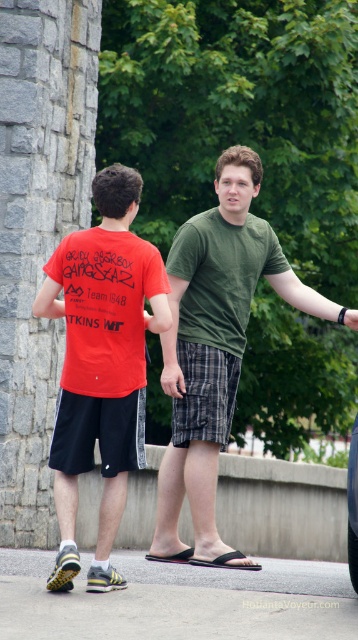
Does matte black hand at center have a greater width compared to black matte wristband at upper right?

In fact, matte black hand at center might be narrower than black matte wristband at upper right.

Does matte black hand at center lie in front of black matte wristband at upper right?

No, it is not.

Find the location of a particular element. The image size is (358, 640). matte black hand at center is located at coordinates (171, 376).

Does green cotton shirt at center have a greater height compared to matte black hand at center?

Yes, green cotton shirt at center is taller than matte black hand at center.

Does green cotton shirt at center have a smaller size compared to matte black hand at center?

No.

Which is in front, point (185, 394) or point (163, 365)?

Positioned in front is point (185, 394).

Identify the location of green cotton shirt at center. This screenshot has height=640, width=358. (215, 348).

Can you confirm if green cotton shirt at center is positioned to the right of black matte wristband at upper right?

Incorrect, green cotton shirt at center is not on the right side of black matte wristband at upper right.

Which is behind, point (258, 176) or point (354, 317)?

Point (258, 176)

At what (x,y) coordinates should I click in order to perform the action: click on green cotton shirt at center. Please return your answer as a coordinate pair (x, y). This screenshot has width=358, height=640. Looking at the image, I should click on pos(215,348).